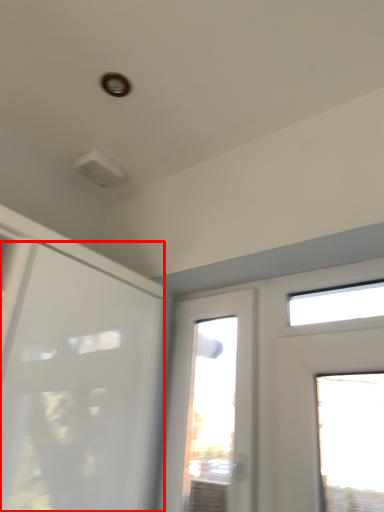
Question: Considering the relative positions of door (annotated by the red box) and window in the image provided, where is door (annotated by the red box) located with respect to the staircase?

Choices:
 (A) right
 (B) left

Answer: (B)